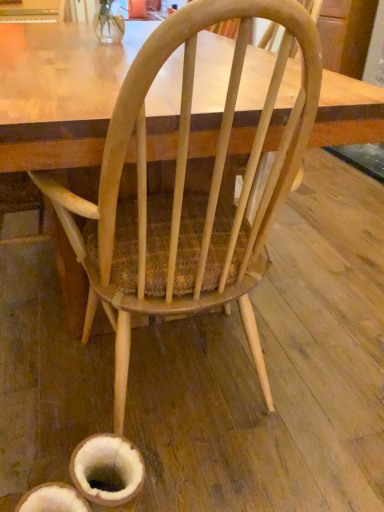
The width and height of the screenshot is (384, 512). Find the location of `natural wood chair at center`. natural wood chair at center is located at coordinates (189, 195).

Describe the element at coordinates (189, 195) in the screenshot. I see `natural wood chair at center` at that location.

Identify the location of natural wood chair at center. The image size is (384, 512). (189, 195).